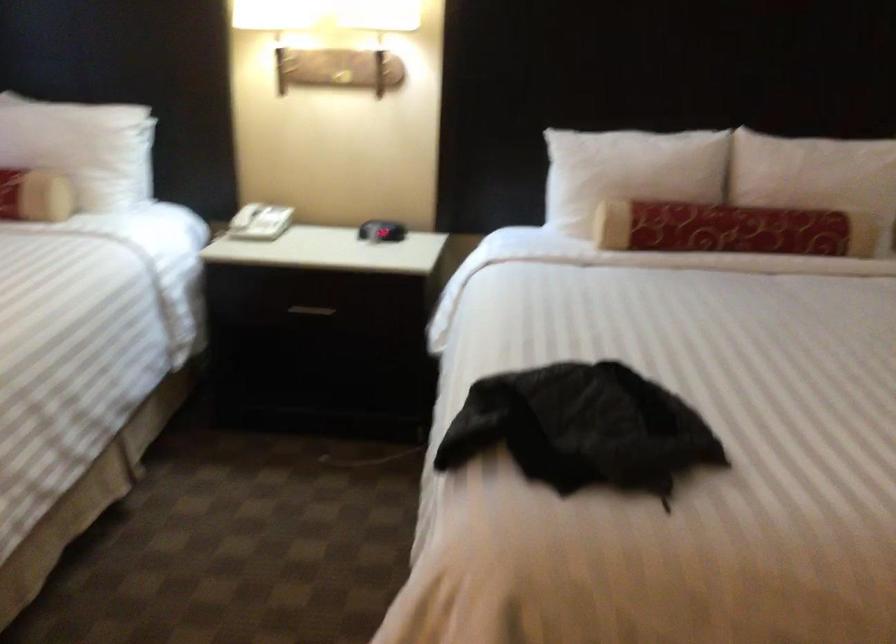
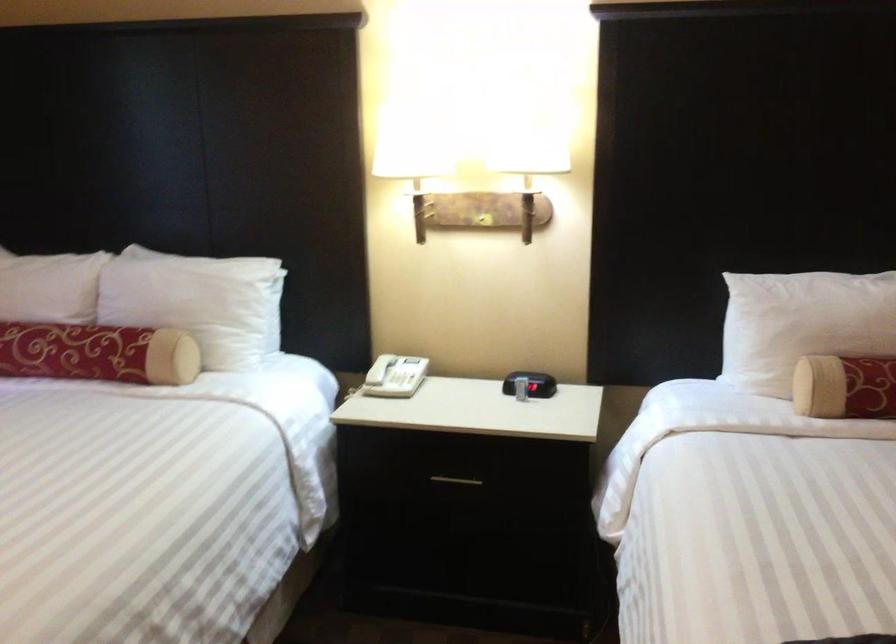
Question: Based on the continuous images, in which direction is the camera rotating? Reply with the corresponding letter.

Choices:
 (A) Left
 (B) Right
 (C) Up
 (D) Down

Answer: (C)